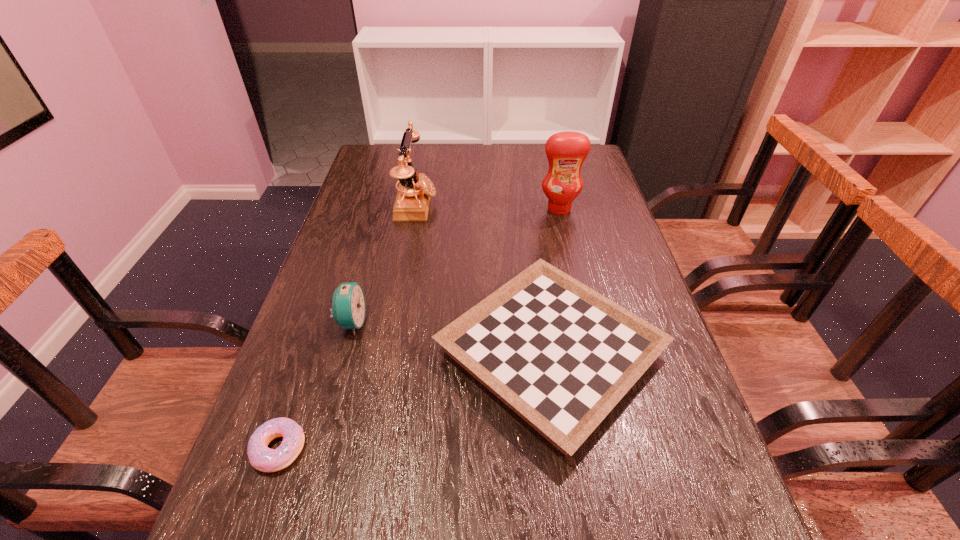
At what (x,y) coordinates should I click in order to perform the action: click on condiment. Please return your answer as a coordinate pair (x, y). Looking at the image, I should click on (566, 151).

I want to click on telephone, so click(412, 202).

Where is `alarm clock`? The width and height of the screenshot is (960, 540). alarm clock is located at coordinates (348, 308).

Identify the location of checkerboard. The height and width of the screenshot is (540, 960). (561, 355).

Where is `doughnut`? doughnut is located at coordinates (262, 458).

Locate an element on the screen. This screenshot has width=960, height=540. vacant space located 0.070m on the label side of the condiment is located at coordinates (564, 231).

This screenshot has width=960, height=540. I want to click on vacant region located on the dial of the third object from left to right, so click(x=479, y=204).

Where is `free spot located on the front-facing side of the third tallest object`? This screenshot has height=540, width=960. free spot located on the front-facing side of the third tallest object is located at coordinates (458, 322).

Identify the location of vacant area situated on the back of the fourth tallest object. (529, 201).

What are the coordinates of `free spot located 0.380m on the right of the doughnut` in the screenshot? It's located at (518, 449).